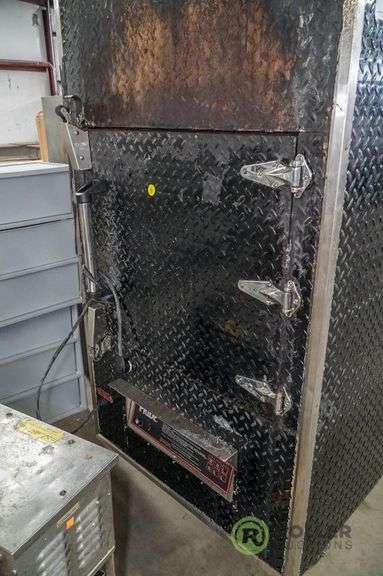
Find the location of a particular element. Image resolution: width=383 pixels, height=576 pixels. floor is located at coordinates (172, 551).